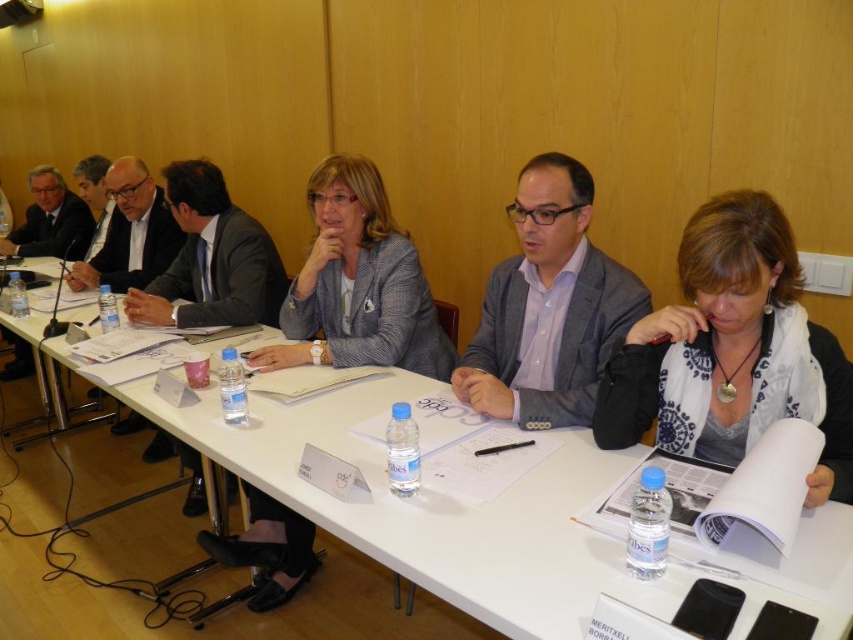
Question: Which point is closer to the camera?

Choices:
 (A) matte gray blazer at center
 (B) white paper at center
 (C) gray textured blazer at center
 (D) white printed scarf at center

Answer: (B)

Question: Can you confirm if white printed scarf at center is wider than matte gray blazer at center?

Choices:
 (A) yes
 (B) no

Answer: (B)

Question: Is white printed scarf at center thinner than gray textured blazer at center?

Choices:
 (A) yes
 (B) no

Answer: (A)

Question: Is the position of white paper at center more distant than that of matte gray blazer at center?

Choices:
 (A) yes
 (B) no

Answer: (B)

Question: Which point is closer to the camera?

Choices:
 (A) white printed scarf at center
 (B) white paper at center
 (C) matte gray blazer at center
 (D) gray textured blazer at center

Answer: (B)

Question: Which object appears farthest from the camera in this image?

Choices:
 (A) white paper at center
 (B) matte gray blazer at center
 (C) white printed scarf at center

Answer: (B)